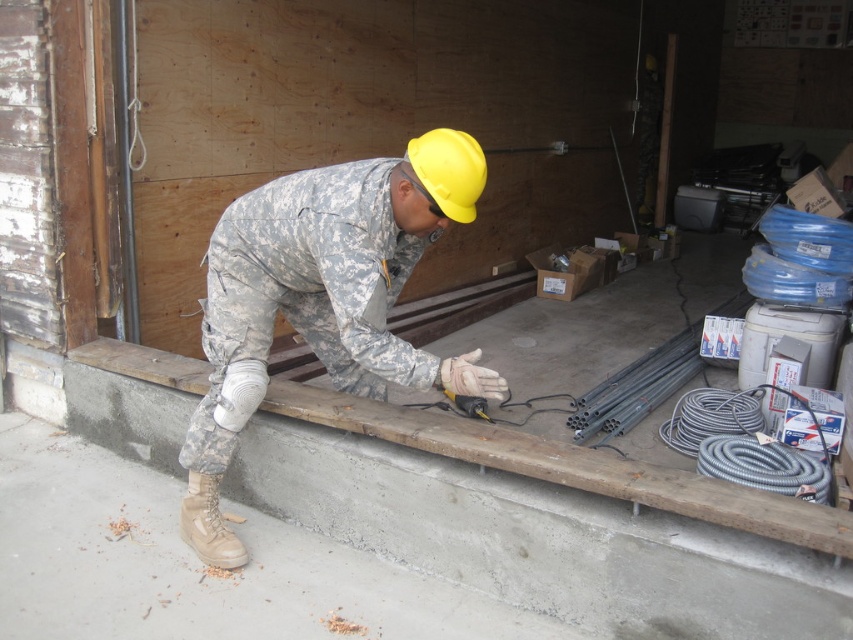
Question: Which point is farther from the camera taking this photo?

Choices:
 (A) (114, 579)
 (B) (759, 525)
 (C) (364, 163)
 (D) (476, 404)

Answer: (D)

Question: Among these objects, which one is nearest to the camera?

Choices:
 (A) camouflage uniform at center
 (B) wooden plank at center
 (C) yellow plastic drill at center
 (D) gray concrete at lower left

Answer: (B)

Question: Is gray concrete at lower left to the left of wooden plank at center from the viewer's perspective?

Choices:
 (A) no
 (B) yes

Answer: (B)

Question: Does gray concrete at lower left come behind camouflage uniform at center?

Choices:
 (A) yes
 (B) no

Answer: (B)

Question: Which of the following is the closest to the observer?

Choices:
 (A) camouflage uniform at center
 (B) yellow plastic drill at center

Answer: (A)

Question: Can you confirm if gray concrete at lower left is positioned to the left of camouflage uniform at center?

Choices:
 (A) yes
 (B) no

Answer: (A)